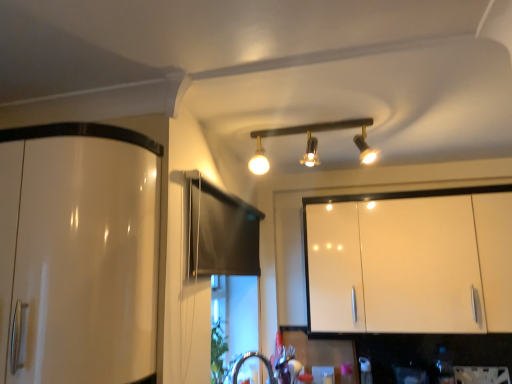
Describe the element at coordinates (411, 264) in the screenshot. I see `white glossy cabinet at upper right, the 2th cabinetry positioned from the left` at that location.

Where is `matte black track lights at center`? matte black track lights at center is located at coordinates (311, 142).

Is white glossy cabinet at upper right, marked as the 2th cabinetry in a front-to-back arrangement, facing away from matte black track lights at center?

No, white glossy cabinet at upper right, marked as the 2th cabinetry in a front-to-back arrangement,'s orientation is not away from matte black track lights at center.

Does white glossy cabinet at upper right, marked as the 2th cabinetry in a front-to-back arrangement, lie behind matte black track lights at center?

Yes, the depth of white glossy cabinet at upper right, marked as the 2th cabinetry in a front-to-back arrangement, is greater than that of matte black track lights at center.

From the image's perspective, who appears lower, white glossy cabinet at upper right, marked as the 2th cabinetry in a front-to-back arrangement, or matte black track lights at center?

white glossy cabinet at upper right, marked as the 2th cabinetry in a front-to-back arrangement, from the image's perspective.

Considering the relative sizes of white glossy cabinet at upper right, which is the first cabinetry in back-to-front order, and matte black track lights at center in the image provided, is white glossy cabinet at upper right, which is the first cabinetry in back-to-front order, shorter than matte black track lights at center?

Incorrect, the height of white glossy cabinet at upper right, which is the first cabinetry in back-to-front order, does not fall short of that of matte black track lights at center.

What are the coordinates of `cabinetry below the white glossy cabinet at upper right, the 2th cabinetry positioned from the left (from a real-world perspective)` in the screenshot? It's located at (78, 253).

From a real-world perspective, between white glossy cabinet at upper right, which is the first cabinetry in back-to-front order, and glossy white cabinet at left, acting as the first cabinetry starting from the front, who is vertically higher?

From a 3D spatial view, white glossy cabinet at upper right, which is the first cabinetry in back-to-front order, is above.

From the image's perspective, who appears lower, white glossy cabinet at upper right, which is the first cabinetry in back-to-front order, or glossy white cabinet at left, placed as the second cabinetry when sorted from right to left?

From the image's view, white glossy cabinet at upper right, which is the first cabinetry in back-to-front order, is below.

Is glossy white cabinet at left, placed as the second cabinetry when sorted from right to left, wider or thinner than matte black track lights at center?

Clearly, glossy white cabinet at left, placed as the second cabinetry when sorted from right to left, has less width compared to matte black track lights at center.

Is point (130, 253) more distant than point (365, 122)?

No, it is not.

Is glossy white cabinet at left, placed as the second cabinetry when sorted from right to left, to the left of matte black track lights at center from the viewer's perspective?

Correct, you'll find glossy white cabinet at left, placed as the second cabinetry when sorted from right to left, to the left of matte black track lights at center.

Is glossy white cabinet at left, the 1th cabinetry positioned from the left, positioned beyond the bounds of matte black track lights at center?

That's correct, glossy white cabinet at left, the 1th cabinetry positioned from the left, is outside of matte black track lights at center.

Considering the sizes of glossy white cabinet at left, the 1th cabinetry positioned from the left, and white glossy cabinet at upper right, which is the first cabinetry in back-to-front order, in the image, is glossy white cabinet at left, the 1th cabinetry positioned from the left, wider or thinner than white glossy cabinet at upper right, which is the first cabinetry in back-to-front order,?

Considering their sizes, glossy white cabinet at left, the 1th cabinetry positioned from the left, looks slimmer than white glossy cabinet at upper right, which is the first cabinetry in back-to-front order.

From the image's perspective, is glossy white cabinet at left, acting as the first cabinetry starting from the front, on white glossy cabinet at upper right, marked as the 2th cabinetry in a front-to-back arrangement?

Correct, glossy white cabinet at left, acting as the first cabinetry starting from the front, appears higher than white glossy cabinet at upper right, marked as the 2th cabinetry in a front-to-back arrangement, in the image.

Between glossy white cabinet at left, the second cabinetry positioned from the back, and white glossy cabinet at upper right, marked as the 2th cabinetry in a front-to-back arrangement, which one has less height?

glossy white cabinet at left, the second cabinetry positioned from the back.

Considering the positions of point (121, 291) and point (421, 278), is point (121, 291) closer or farther from the camera than point (421, 278)?

Point (121, 291) is positioned closer to the camera compared to point (421, 278).

Is matte black track lights at center outside of white glossy cabinet at upper right, which is the first cabinetry in back-to-front order?

Indeed, matte black track lights at center is completely outside white glossy cabinet at upper right, which is the first cabinetry in back-to-front order.

From a real-world perspective, between matte black track lights at center and white glossy cabinet at upper right, marked as the 2th cabinetry in a front-to-back arrangement, who is vertically lower?

white glossy cabinet at upper right, marked as the 2th cabinetry in a front-to-back arrangement, is physically lower.

Is matte black track lights at center aimed at white glossy cabinet at upper right, acting as the 1th cabinetry starting from the right?

No, matte black track lights at center does not turn towards white glossy cabinet at upper right, acting as the 1th cabinetry starting from the right.

From the image's perspective, is matte black track lights at center on top of white glossy cabinet at upper right, which is the first cabinetry in back-to-front order?

Yes, from the image's perspective, matte black track lights at center is above white glossy cabinet at upper right, which is the first cabinetry in back-to-front order.

Looking at this image, can you tell me how much matte black track lights at center and glossy white cabinet at left, acting as the first cabinetry starting from the front, differ in facing direction?

89.1 degrees.

Based on the photo, could you tell me if matte black track lights at center is turned towards glossy white cabinet at left, the 1th cabinetry positioned from the left?

No, matte black track lights at center is not aimed at glossy white cabinet at left, the 1th cabinetry positioned from the left.

Is matte black track lights at center next to glossy white cabinet at left, the 1th cabinetry positioned from the left, and touching it?

No, matte black track lights at center is not with glossy white cabinet at left, the 1th cabinetry positioned from the left.

Based on their positions, is matte black track lights at center located to the left or right of glossy white cabinet at left, the second cabinetry positioned from the back?

In the image, matte black track lights at center appears on the right side of glossy white cabinet at left, the second cabinetry positioned from the back.

I want to click on the 2nd cabinetry below the matte black track lights at center (from the image's perspective), so click(411, 264).

At what (x,y) coordinates should I click in order to perform the action: click on cabinetry behind the glossy white cabinet at left, acting as the first cabinetry starting from the front. Please return your answer as a coordinate pair (x, y). Looking at the image, I should click on (411, 264).

From the image, which object appears to be nearer to white glossy cabinet at upper right, the 2th cabinetry positioned from the left, matte black track lights at center or glossy white cabinet at left, the second cabinetry positioned from the back?

Based on the image, matte black track lights at center appears to be nearer to white glossy cabinet at upper right, the 2th cabinetry positioned from the left.

From the image, which object appears to be farther from white glossy cabinet at upper right, marked as the 2th cabinetry in a front-to-back arrangement, glossy white cabinet at left, placed as the second cabinetry when sorted from right to left, or matte black track lights at center?

glossy white cabinet at left, placed as the second cabinetry when sorted from right to left, lies further to white glossy cabinet at upper right, marked as the 2th cabinetry in a front-to-back arrangement, than the other object.

Looking at the image, which one is located further to matte black track lights at center, white glossy cabinet at upper right, acting as the 1th cabinetry starting from the right, or glossy white cabinet at left, the 1th cabinetry positioned from the left?

glossy white cabinet at left, the 1th cabinetry positioned from the left.

Looking at the image, which one is located closer to glossy white cabinet at left, placed as the second cabinetry when sorted from right to left, white glossy cabinet at upper right, the 2th cabinetry positioned from the left, or matte black track lights at center?

matte black track lights at center.

Looking at the image, which one is located closer to matte black track lights at center, glossy white cabinet at left, acting as the first cabinetry starting from the front, or white glossy cabinet at upper right, the 2th cabinetry positioned from the left?

Based on the image, white glossy cabinet at upper right, the 2th cabinetry positioned from the left, appears to be nearer to matte black track lights at center.

Considering their positions, is matte black track lights at center positioned further to glossy white cabinet at left, placed as the second cabinetry when sorted from right to left, than white glossy cabinet at upper right, marked as the 2th cabinetry in a front-to-back arrangement?

white glossy cabinet at upper right, marked as the 2th cabinetry in a front-to-back arrangement, is positioned further to the anchor glossy white cabinet at left, placed as the second cabinetry when sorted from right to left.

Locate an element on the screen. The image size is (512, 384). lamp located between glossy white cabinet at left, acting as the first cabinetry starting from the front, and white glossy cabinet at upper right, which is the first cabinetry in back-to-front order, in the left-right direction is located at coordinates (311, 142).